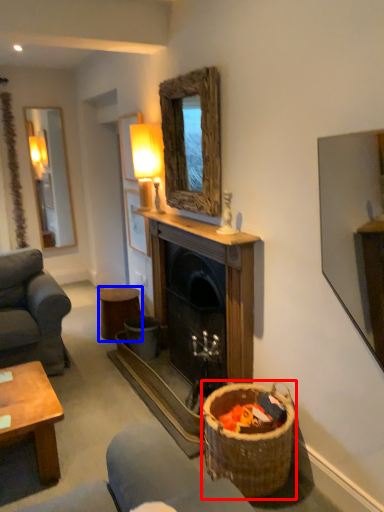
Question: Which object is further to the camera taking this photo, basket (highlighted by a red box) or stool (highlighted by a blue box)?

Choices:
 (A) basket
 (B) stool

Answer: (B)